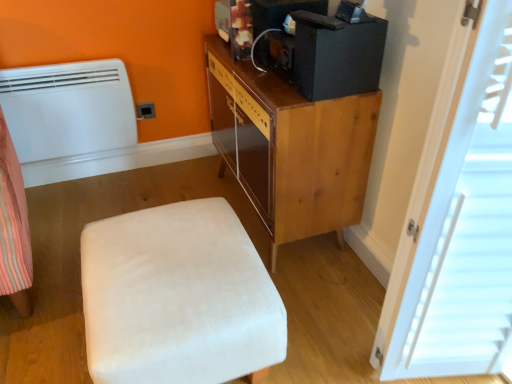
At what (x,y) coordinates should I click in order to perform the action: click on free space that is to the left of white wood door at right. Please return your answer as a coordinate pair (x, y). The image size is (512, 384). Looking at the image, I should click on (328, 336).